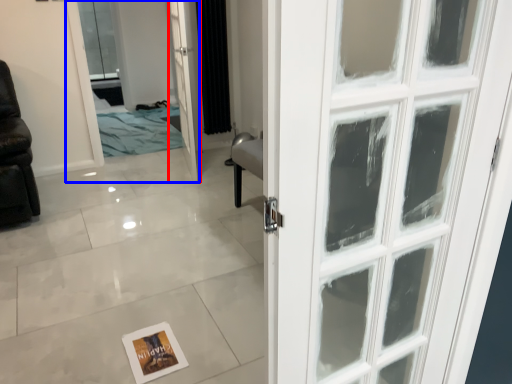
Question: Which object is closer to the camera taking this photo, door (highlighted by a red box) or elevator (highlighted by a blue box)?

Choices:
 (A) door
 (B) elevator

Answer: (A)